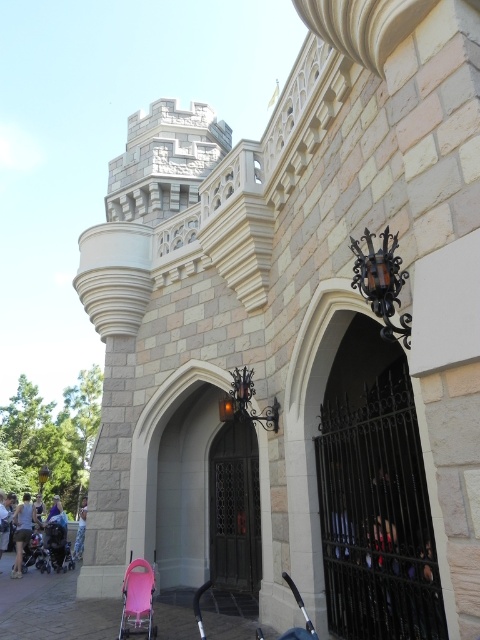
Which is above, pink fabric stroller at lower center or matte gray shorts at lower left?

pink fabric stroller at lower center is above.

Between pink fabric stroller at lower center and matte gray shorts at lower left, which one appears on the left side from the viewer's perspective?

matte gray shorts at lower left is more to the left.

Locate an element on the screen. The image size is (480, 640). pink fabric stroller at lower center is located at coordinates (137, 600).

Can you confirm if matte gray shorts at lower left is smaller than light blue denim shorts at lower left?

No.

Looking at this image, who is more forward, (x=24, y=496) or (x=85, y=497)?

Point (x=24, y=496) is in front.

Find the location of `matte gray shorts at lower left`. matte gray shorts at lower left is located at coordinates (23, 531).

Image resolution: width=480 pixels, height=640 pixels. In order to click on matte gray shorts at lower left in this screenshot , I will do `click(23, 531)`.

Does matte black stroller at lower left appear over matte gray shorts at lower left?

Correct, matte black stroller at lower left is located above matte gray shorts at lower left.

Does matte black stroller at lower left appear on the left side of matte gray shorts at lower left?

Incorrect, matte black stroller at lower left is not on the left side of matte gray shorts at lower left.

Locate an element on the screen. The image size is (480, 640). matte black stroller at lower left is located at coordinates (52, 541).